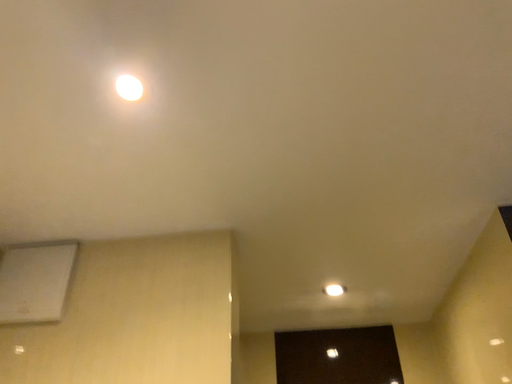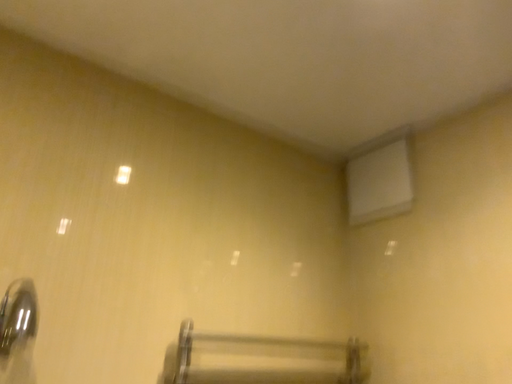
Question: Which way did the camera rotate in the video?

Choices:
 (A) rotated downward
 (B) rotated upward

Answer: (A)